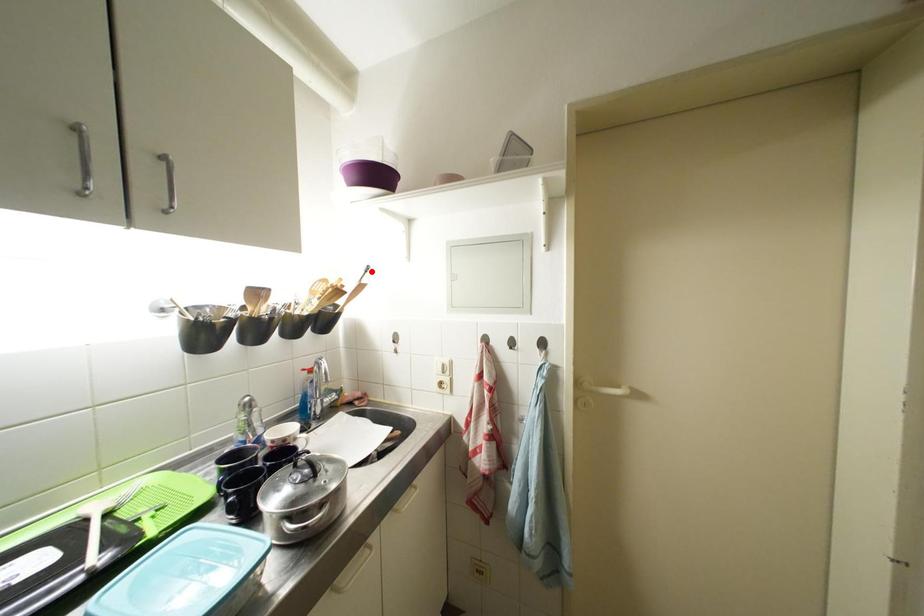
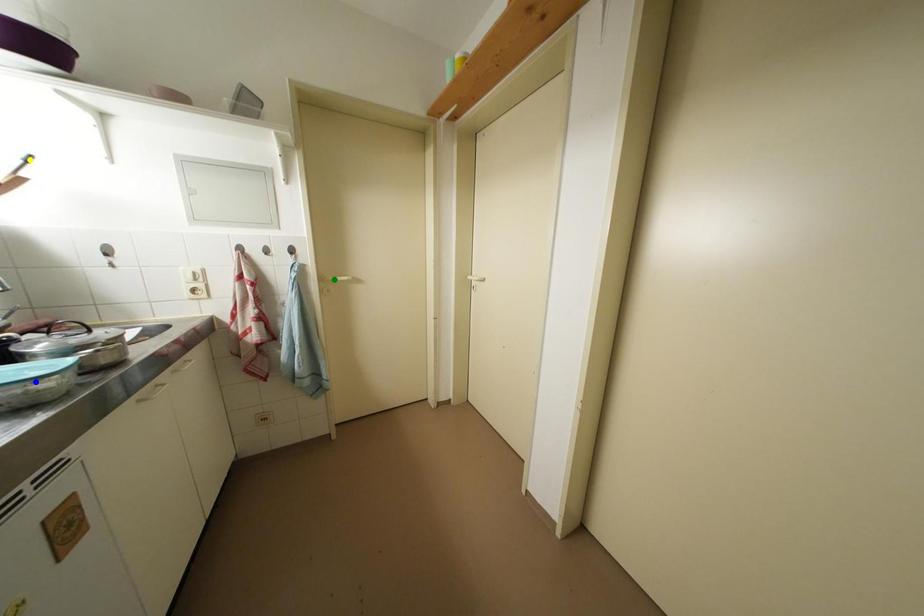
Question: I am providing you with two images of the same scene from different viewpoints. A red point is marked on the first image. You are given multiple points on the second image. Which mark in image 2 goes with the point in image 1?

Choices:
 (A) green point
 (B) yellow point
 (C) blue point

Answer: (B)